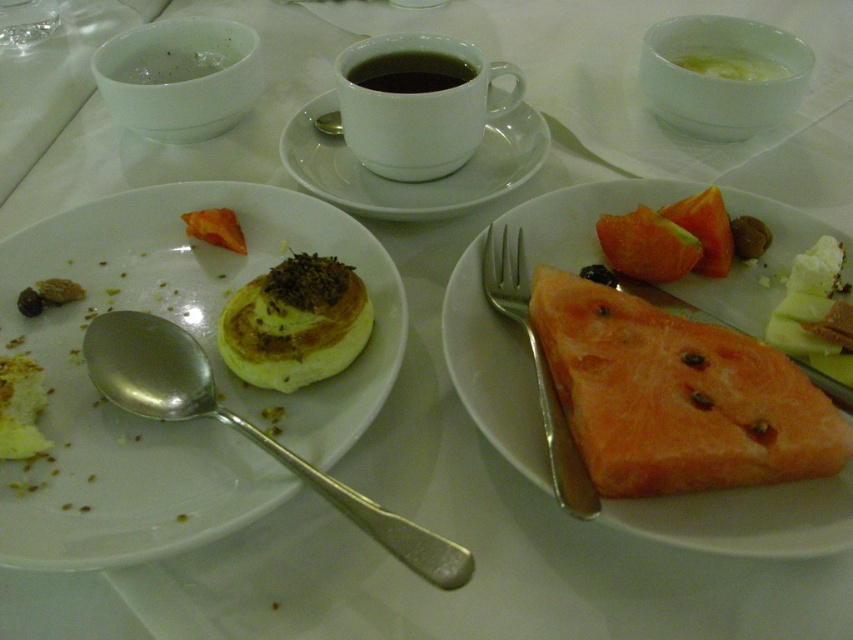
Question: Which object is farther from the camera taking this photo?

Choices:
 (A) yellow crumbly pastry at center
 (B) orange fleshed fruit at center
 (C) smooth brown nut at upper right
 (D) orange fleshed melon at right

Answer: (C)

Question: Does white ceramic saucer at center appear on the right side of orange fleshed watermelon at right?

Choices:
 (A) no
 (B) yes

Answer: (A)

Question: Among these objects, which one is nearest to the camera?

Choices:
 (A) white ceramic saucer at center
 (B) silver metallic spoon at upper center
 (C) orange juicy watermelon at right
 (D) orange matte pastry at center-left

Answer: (C)

Question: Observing the image, what is the correct spatial positioning of yellow crumbly cake at center-left in reference to orange matte pastry at center-left?

Choices:
 (A) right
 (B) left

Answer: (B)

Question: Is orange fleshed watermelon at right to the right of silver metallic spoon at upper center from the viewer's perspective?

Choices:
 (A) yes
 (B) no

Answer: (A)

Question: Which of the following is the farthest from the observer?

Choices:
 (A) (312, 124)
 (B) (32, 371)

Answer: (A)